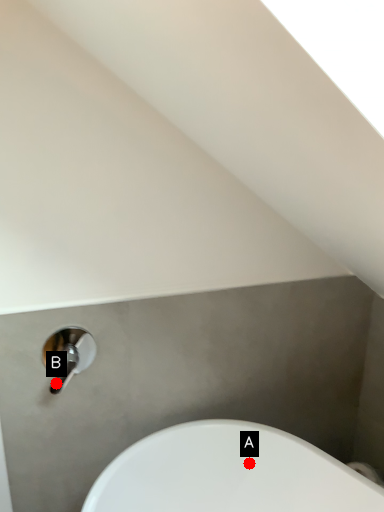
Question: Two points are circled on the image, labeled by A and B beside each circle. Which of the following is the farthest from the observer?

Choices:
 (A) A is further
 (B) B is further

Answer: (A)